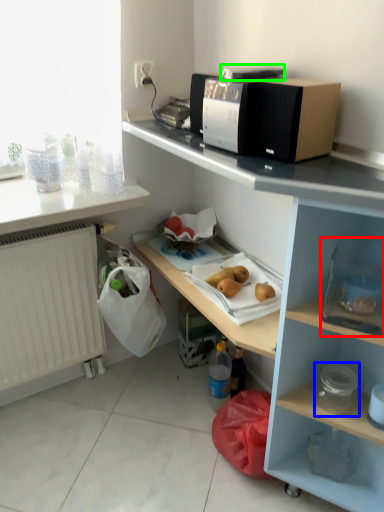
Question: Which object is positioned farthest from box (highlighted by a red box)? Select from appliance (highlighted by a blue box) and appliance (highlighted by a green box).

Choices:
 (A) appliance
 (B) appliance

Answer: (B)